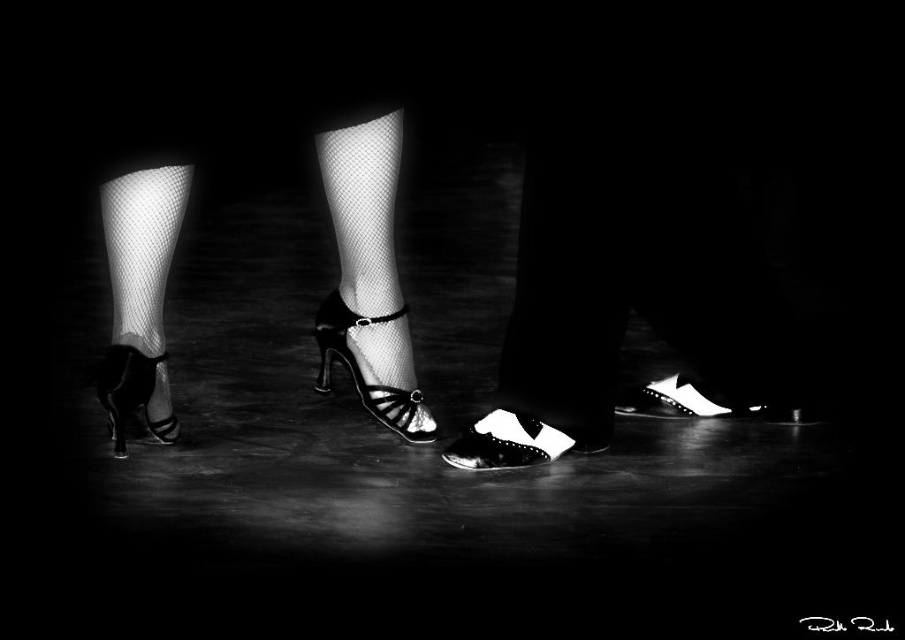
Question: Which of these objects is positioned farthest from the white leather shoe at lower right?

Choices:
 (A) shiny black leather shoe at center
 (B) shiny metallic sandal at center
 (C) white leather shoe at center
 (D) shiny black sandal at lower left

Answer: (D)

Question: From the image, what is the correct spatial relationship of white leather shoe at center in relation to shiny metallic sandal at center?

Choices:
 (A) right
 (B) left

Answer: (A)

Question: Considering the relative positions of white leather shoe at lower right and shiny black sandal at lower left in the image provided, where is white leather shoe at lower right located with respect to shiny black sandal at lower left?

Choices:
 (A) below
 (B) above

Answer: (A)

Question: From the image, what is the correct spatial relationship of shiny black leather shoe at center in relation to shiny black sandal at lower left?

Choices:
 (A) below
 (B) above

Answer: (A)

Question: Which point is farther to the camera?

Choices:
 (A) white leather shoe at lower right
 (B) white leather shoe at center
 (C) shiny black sandal at lower left

Answer: (A)

Question: Which object is the closest to the shiny black sandal at lower left?

Choices:
 (A) shiny black leather shoe at center
 (B) white leather shoe at lower right

Answer: (A)